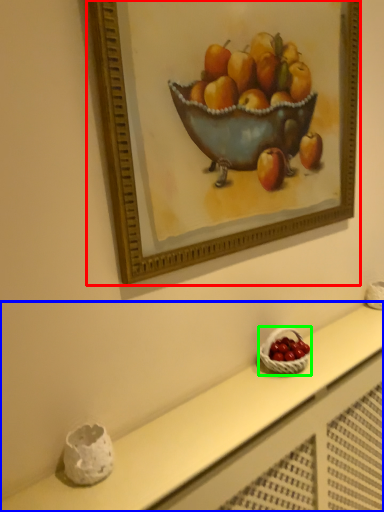
Question: Which object is positioned closest to picture frame (highlighted by a red box)? Select from table (highlighted by a blue box) and basket (highlighted by a green box).

Choices:
 (A) table
 (B) basket

Answer: (A)